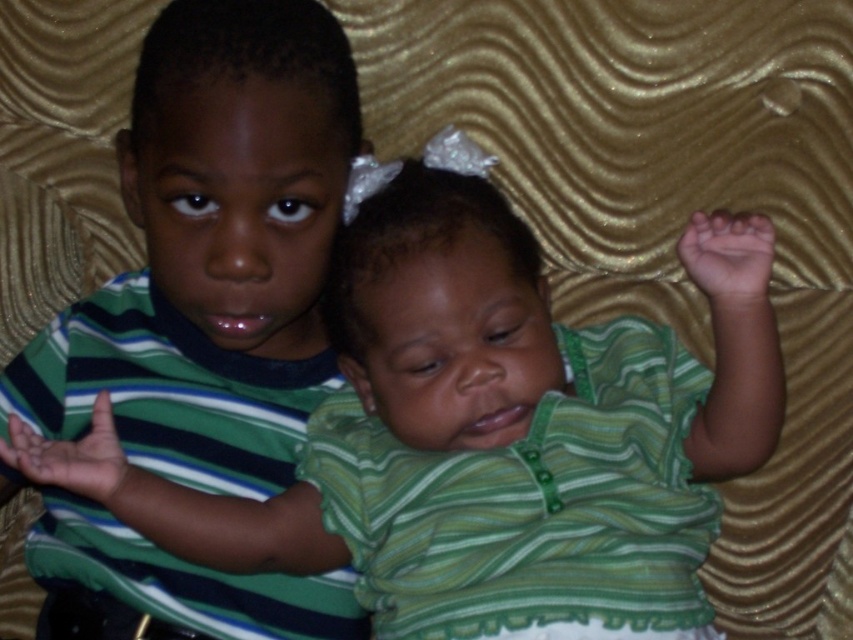
Does green striped shirt at center lie in front of green striped shirt at left?

Yes, it is.

Which of these two, green striped shirt at center or green striped shirt at left, stands shorter?

With less height is green striped shirt at center.

Which is behind, point (715, 524) or point (201, 140)?

The point (715, 524) is more distant.

In order to click on green striped shirt at center in this screenshot , I will do `click(486, 420)`.